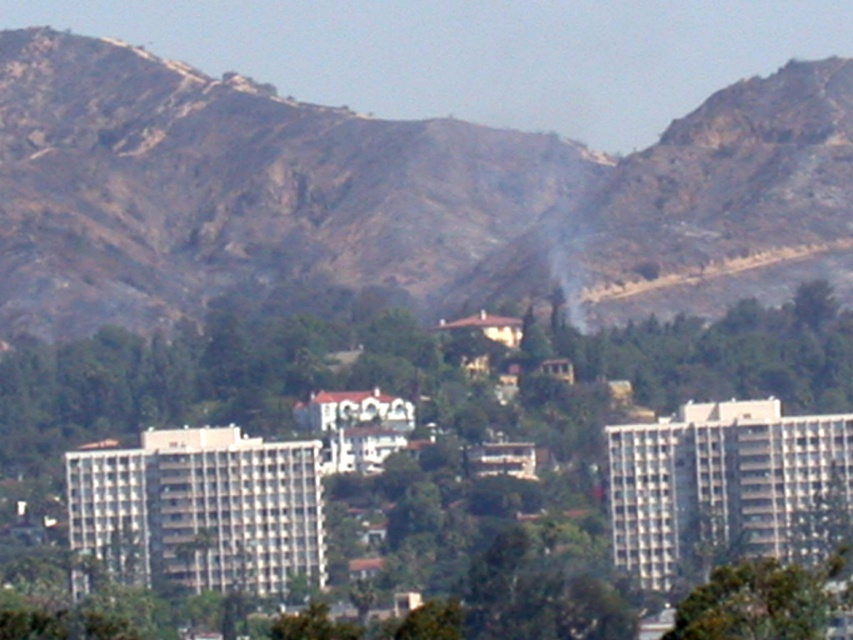
You are standing in the urban landscape and notice two green leafy trees. One is labeled as the green leafy tree at center, and the other is the green leafy tree at lower right. From your current position, which tree is positioned to the left?

The green leafy tree at center is positioned to the left of the green leafy tree at lower right.

You are planning to build a small cabin in this area. The cabin requires a space larger than the brown rocky mountain at center. Can the green leafy tree at lower right provide enough space for your cabin?

The brown rocky mountain at center is larger than the green leafy tree at lower right, so the green leafy tree at lower right does not provide enough space for the cabin which requires a space larger than the brown rocky mountain at center.

You are standing in the landscape scene described, and you need to determine which object is taller between the brown rocky mountain at center and the green leafy tree at center. Based on the scene, which one is taller?

The green leafy tree at center is taller than the brown rocky mountain at center according to the description provided.